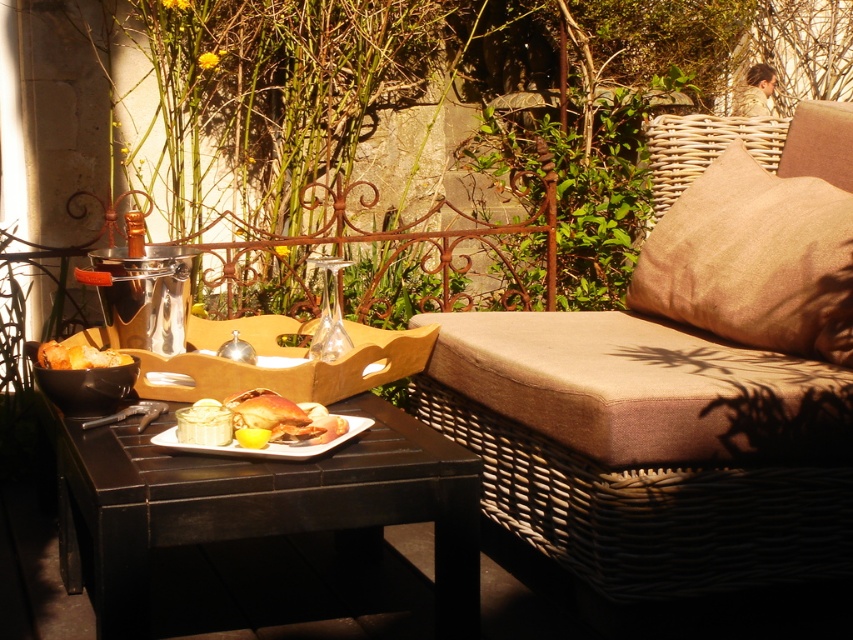
The width and height of the screenshot is (853, 640). Describe the element at coordinates (648, 448) in the screenshot. I see `beige woven cushion at right` at that location.

Identify the location of beige woven cushion at right. (648, 448).

Is point (500, 500) farther from viewer compared to point (772, 253)?

That is True.

Where is `beige woven cushion at right`? This screenshot has width=853, height=640. beige woven cushion at right is located at coordinates (648, 448).

Between point (792, 225) and point (259, 422), which one is positioned behind?

Point (792, 225)

Who is shorter, burlap cushion at right or shiny silver crab at center?

shiny silver crab at center

Is point (791, 250) behind point (231, 397)?

Yes, it is behind point (231, 397).

At what (x,y) coordinates should I click in order to perform the action: click on burlap cushion at right. Please return your answer as a coordinate pair (x, y). Looking at the image, I should click on (753, 259).

Which is more to the left, white glossy platter at center or golden crispy chicken at center?

Positioned to the left is golden crispy chicken at center.

Between white glossy platter at center and golden crispy chicken at center, which one is positioned higher?

Positioned higher is golden crispy chicken at center.

Measure the distance between white glossy platter at center and camera.

white glossy platter at center is 1.74 meters away from camera.

What are the coordinates of `white glossy platter at center` in the screenshot? It's located at (265, 444).